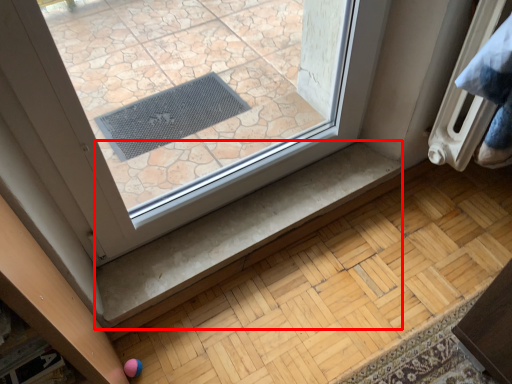
Question: From the image, what is the correct spatial relationship of stair (annotated by the red box) in relation to radiator?

Choices:
 (A) left
 (B) right

Answer: (A)